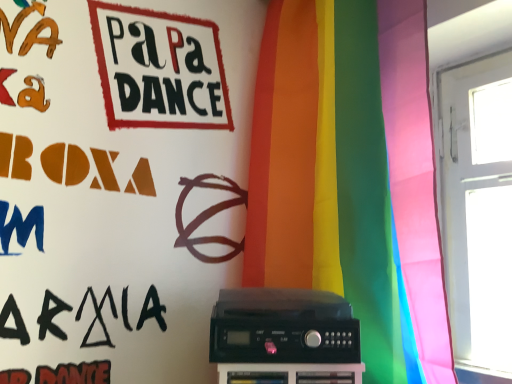
Describe the element at coordinates (349, 169) in the screenshot. I see `rainbow fabric curtain at center` at that location.

What is the approximate height of rainbow fabric curtain at center?

rainbow fabric curtain at center is 4.24 feet tall.

This screenshot has height=384, width=512. Find the location of `rainbow fabric curtain at center`. rainbow fabric curtain at center is located at coordinates (349, 169).

What do you see at coordinates (283, 327) in the screenshot? I see `black plastic amplifier at center` at bounding box center [283, 327].

Where is `black plastic amplifier at center`? The height and width of the screenshot is (384, 512). black plastic amplifier at center is located at coordinates (283, 327).

I want to click on rainbow fabric curtain at center, so click(x=349, y=169).

Which object is positioned more to the left, black plastic amplifier at center or rainbow fabric curtain at center?

black plastic amplifier at center is more to the left.

Considering the positions of objects black plastic amplifier at center and rainbow fabric curtain at center in the image provided, who is in front, black plastic amplifier at center or rainbow fabric curtain at center?

rainbow fabric curtain at center is more forward.

Is point (243, 297) farther from viewer compared to point (394, 131)?

That is False.

From the image's perspective, is black plastic amplifier at center above or below rainbow fabric curtain at center?

black plastic amplifier at center is situated lower than rainbow fabric curtain at center in the image.

From a real-world perspective, which is physically above, black plastic amplifier at center or rainbow fabric curtain at center?

From a 3D spatial view, rainbow fabric curtain at center is above.

In terms of width, does black plastic amplifier at center look wider or thinner when compared to rainbow fabric curtain at center?

black plastic amplifier at center is thinner than rainbow fabric curtain at center.

Can you confirm if black plastic amplifier at center is shorter than rainbow fabric curtain at center?

Correct, black plastic amplifier at center is not as tall as rainbow fabric curtain at center.

Who is smaller, black plastic amplifier at center or rainbow fabric curtain at center?

black plastic amplifier at center.

Is black plastic amplifier at center surrounding rainbow fabric curtain at center?

No, rainbow fabric curtain at center is not inside black plastic amplifier at center.

Would you consider black plastic amplifier at center to be distant from rainbow fabric curtain at center?

That's not correct — black plastic amplifier at center is a little close to rainbow fabric curtain at center.

Could you tell me if black plastic amplifier at center is facing rainbow fabric curtain at center?

No, black plastic amplifier at center does not turn towards rainbow fabric curtain at center.

Locate an element on the screen. The width and height of the screenshot is (512, 384). amplifier that appears behind the rainbow fabric curtain at center is located at coordinates (283, 327).

Considering the relative positions of rainbow fabric curtain at center and black plastic amplifier at center in the image provided, is rainbow fabric curtain at center to the left of black plastic amplifier at center from the viewer's perspective?

Incorrect, rainbow fabric curtain at center is not on the left side of black plastic amplifier at center.

Is rainbow fabric curtain at center further to the viewer compared to black plastic amplifier at center?

No.

Which is nearer, (266, 178) or (249, 353)?

Point (266, 178) is positioned farther from the camera compared to point (249, 353).

From the picture: From the image's perspective, which one is positioned higher, rainbow fabric curtain at center or black plastic amplifier at center?

rainbow fabric curtain at center.

From a real-world perspective, is rainbow fabric curtain at center under black plastic amplifier at center?

No, from a real-world perspective, rainbow fabric curtain at center is not under black plastic amplifier at center.

Between rainbow fabric curtain at center and black plastic amplifier at center, which one has smaller width?

black plastic amplifier at center.

Which of these two, rainbow fabric curtain at center or black plastic amplifier at center, stands taller?

With more height is rainbow fabric curtain at center.

Between rainbow fabric curtain at center and black plastic amplifier at center, which one has larger size?

Bigger between the two is rainbow fabric curtain at center.

Is black plastic amplifier at center surrounded by rainbow fabric curtain at center?

No, black plastic amplifier at center is not a part of rainbow fabric curtain at center.

Would you consider rainbow fabric curtain at center to be distant from black plastic amplifier at center?

No, rainbow fabric curtain at center is not far from black plastic amplifier at center.

Is rainbow fabric curtain at center facing towards black plastic amplifier at center?

Yes, rainbow fabric curtain at center is facing black plastic amplifier at center.

How many degrees apart are the facing directions of rainbow fabric curtain at center and black plastic amplifier at center?

They differ by 58.9 degrees in their facing directions.

Identify the location of curtain in front of the black plastic amplifier at center. (349, 169).

Identify the location of amplifier that is under the rainbow fabric curtain at center (from a real-world perspective). (283, 327).

Find the location of a particular element. Image resolution: width=512 pixels, height=384 pixels. curtain to the right of black plastic amplifier at center is located at coordinates (349, 169).